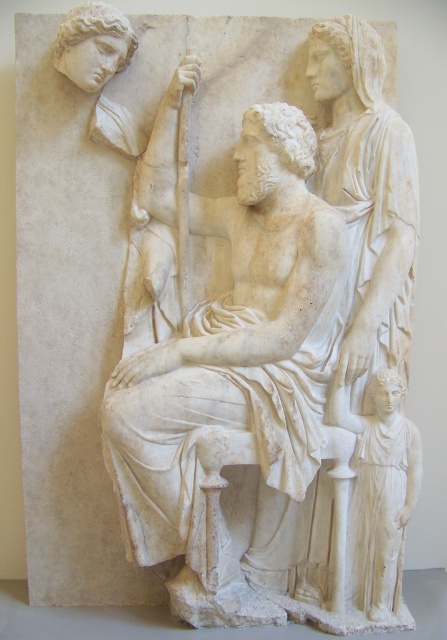
Is white marble statue at center above white marble statue at lower right?

Yes.

Is point (122, 448) positioned behind point (370, 534)?

No, (122, 448) is in front of (370, 534).

Between point (177, 554) and point (358, 413), which one is positioned in front?

Point (177, 554)

I want to click on white marble statue at center, so click(240, 385).